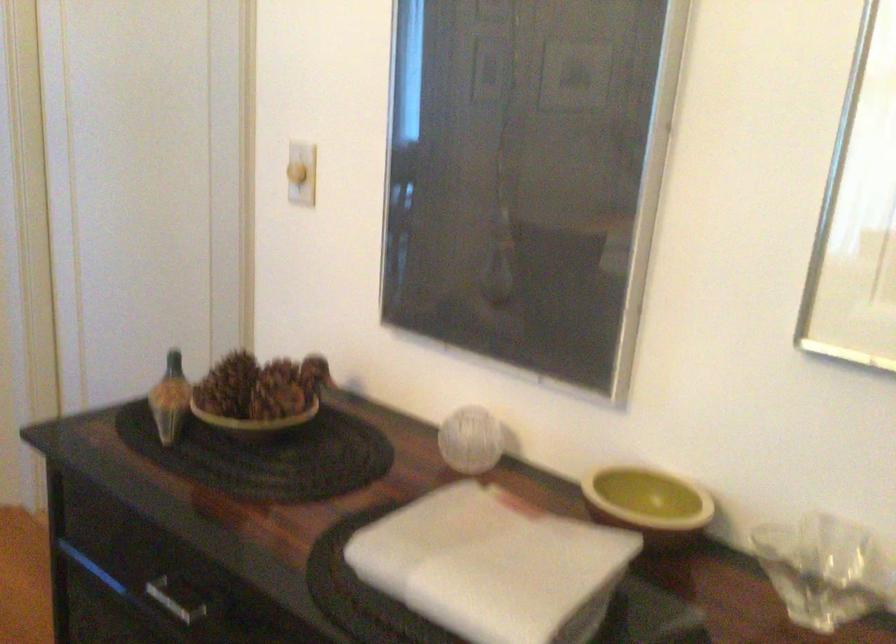
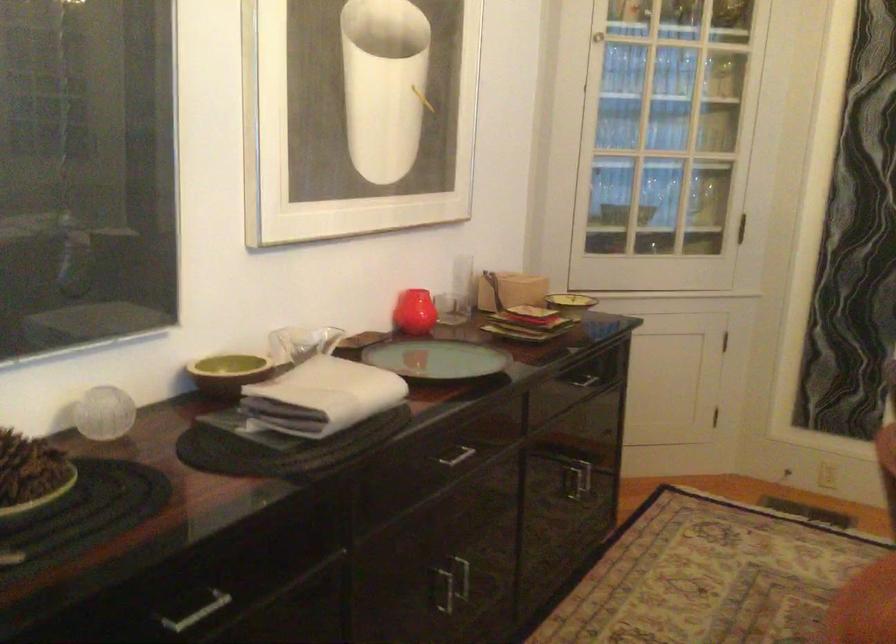
Where in the second image is the point corresponding to point 210,404 from the first image?

(30, 475)